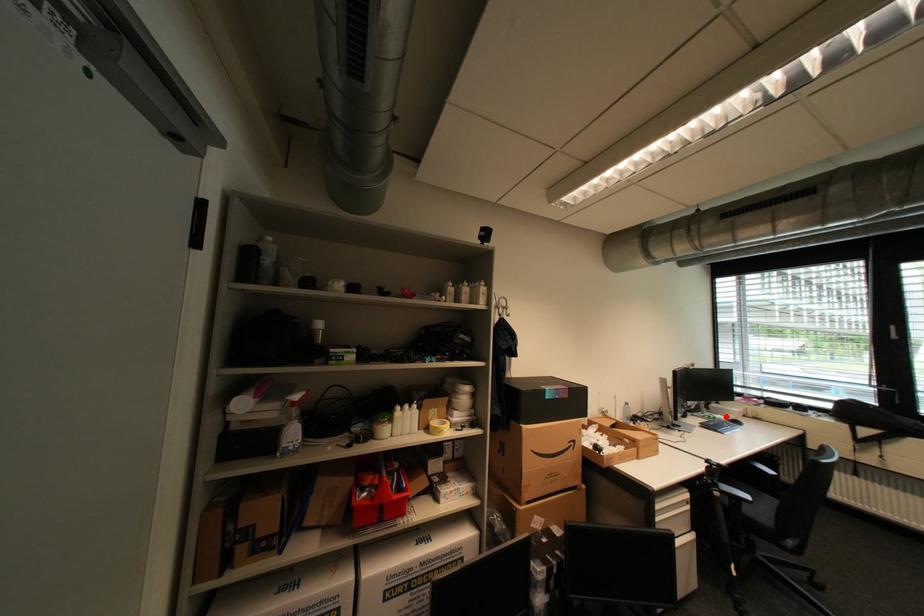
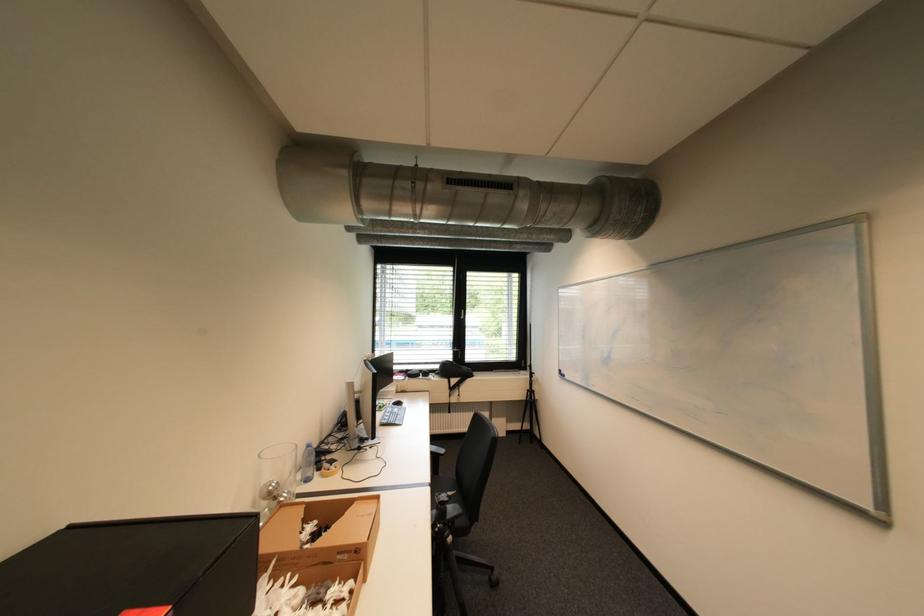
The point at the highlighted location is marked in the first image. Where is the corresponding point in the second image?

(393, 403)